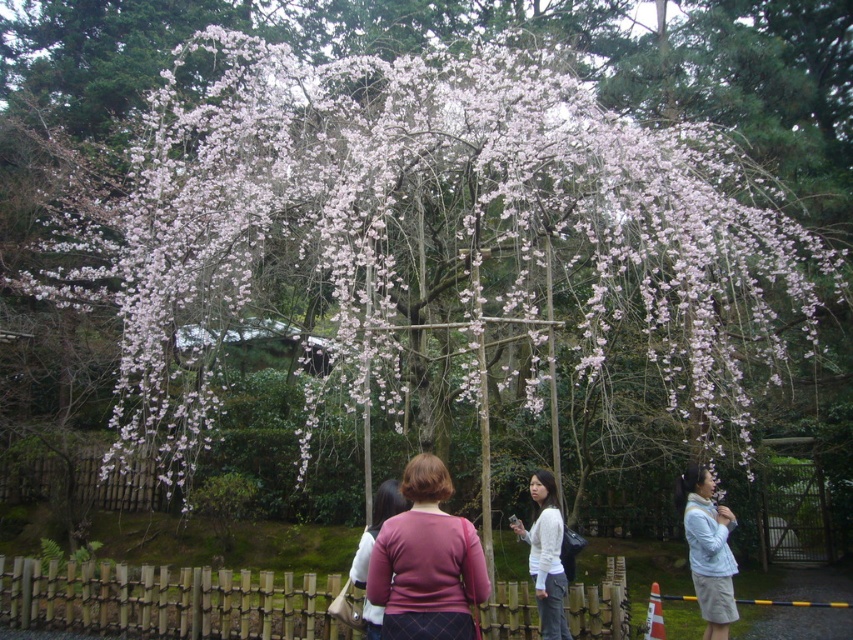
Is light blue sweater at lower right thinner than matte pink sweater at center?

In fact, light blue sweater at lower right might be wider than matte pink sweater at center.

How much distance is there between light blue sweater at lower right and matte pink sweater at center?

The distance of light blue sweater at lower right from matte pink sweater at center is 3.34 meters.

Is point (720, 554) positioned after point (363, 550)?

Yes, it is behind point (363, 550).

Where is `light blue sweater at lower right`? Image resolution: width=853 pixels, height=640 pixels. light blue sweater at lower right is located at coordinates (709, 552).

Is wooden at center further to the viewer compared to light blue sweater at lower right?

Yes, wooden at center is further from the viewer.

Can you confirm if wooden at center is taller than light blue sweater at lower right?

No, wooden at center is not taller than light blue sweater at lower right.

Which is in front, point (231, 588) or point (732, 595)?

Point (732, 595) is more forward.

This screenshot has width=853, height=640. In order to click on wooden at center in this screenshot , I will do `click(167, 600)`.

Can you confirm if pink fabric sweater at center is smaller than matte pink sweater at center?

No, pink fabric sweater at center is not smaller than matte pink sweater at center.

Is point (369, 573) closer to camera compared to point (363, 625)?

Yes, point (369, 573) is in front of point (363, 625).

Does point (387, 627) lie in front of point (369, 556)?

Yes, point (387, 627) is in front of point (369, 556).

Where is `pink fabric sweater at center`? pink fabric sweater at center is located at coordinates (427, 563).